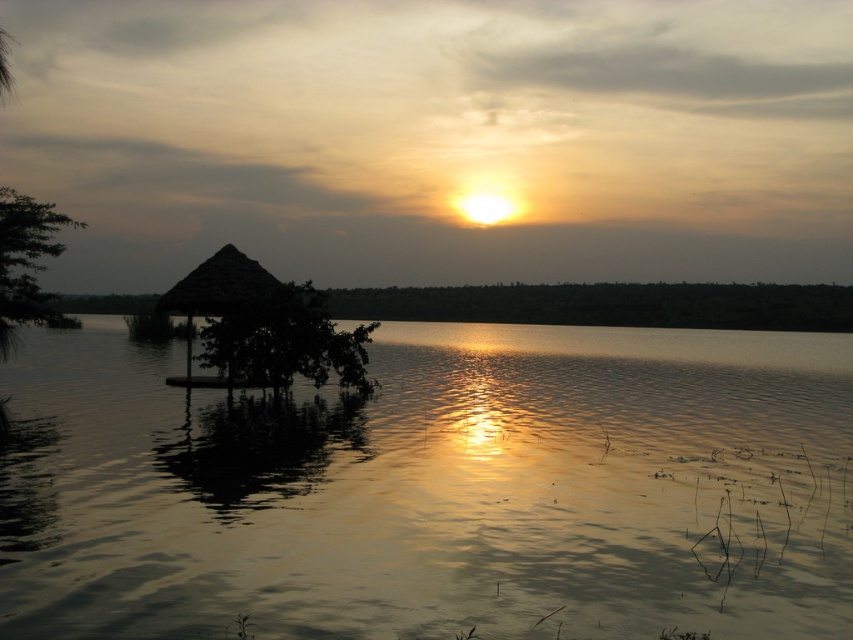
Does matte thatched hut at left have a smaller size compared to thatched straw hut at center?

Incorrect, matte thatched hut at left is not smaller in size than thatched straw hut at center.

Who is more distant from viewer, (173, 632) or (210, 257)?

The point (210, 257) is more distant.

Where is `matte thatched hut at left`? matte thatched hut at left is located at coordinates (434, 490).